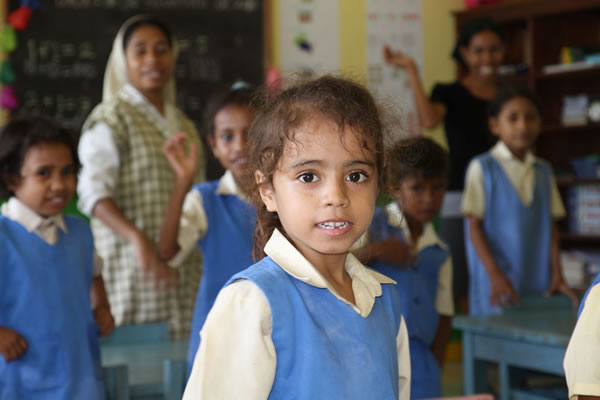
Locate an element on the screen. The width and height of the screenshot is (600, 400). chalkboard is located at coordinates (75, 53).